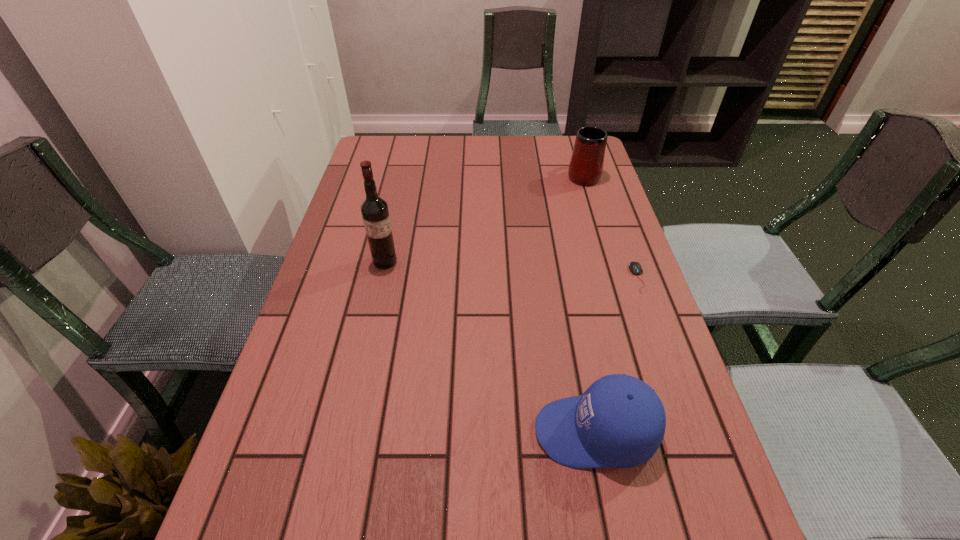
This screenshot has width=960, height=540. I want to click on wine bottle, so click(x=374, y=210).

Where is `the tallest object`? The height and width of the screenshot is (540, 960). the tallest object is located at coordinates (374, 210).

This screenshot has height=540, width=960. I want to click on mug, so click(586, 165).

Locate an element on the screen. the farthest object is located at coordinates (586, 165).

Where is `cap`? cap is located at coordinates (619, 422).

In order to click on the second shortest object in this screenshot , I will do `click(619, 422)`.

This screenshot has width=960, height=540. Find the location of `mouse`. mouse is located at coordinates (635, 267).

Identify the location of vacant space located on the front and back of the leftmost object. The height and width of the screenshot is (540, 960). (371, 325).

This screenshot has height=540, width=960. What are the coordinates of `free space located 0.100m on the side of the mug with the handle` in the screenshot? It's located at (575, 148).

Locate an element on the screen. free location located 0.060m on the side of the mug with the handle is located at coordinates (577, 154).